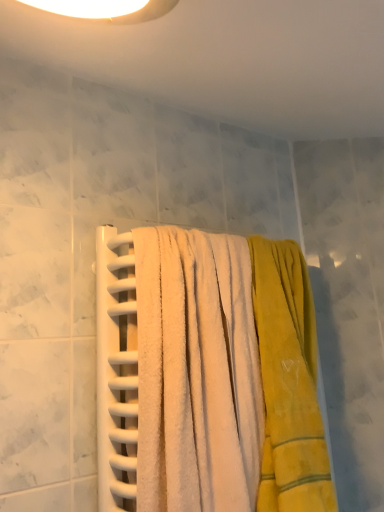
Question: Which direction should I rotate to look at white soft towel at center, the first towel viewed from the left?

Choices:
 (A) right
 (B) left

Answer: (A)

Question: Is yellow soft towel at center, the 1th towel in the right-to-left sequence, beside white soft towel at center, the first towel viewed from the left?

Choices:
 (A) no
 (B) yes

Answer: (A)

Question: Is white soft towel at center, the first towel viewed from the left, at the back of yellow soft towel at center, the 1th towel in the right-to-left sequence?

Choices:
 (A) yes
 (B) no

Answer: (B)

Question: Is white soft towel at center, the 2th towel when ordered from right to left, located within yellow soft towel at center, the 1th towel in the right-to-left sequence?

Choices:
 (A) no
 (B) yes

Answer: (A)

Question: Does yellow soft towel at center, which is the second towel in left-to-right order, have a larger size compared to white soft towel at center, the first towel viewed from the left?

Choices:
 (A) no
 (B) yes

Answer: (A)

Question: Does yellow soft towel at center, which is the second towel in left-to-right order, come behind white soft towel at center, the 2th towel when ordered from right to left?

Choices:
 (A) no
 (B) yes

Answer: (B)

Question: Does yellow soft towel at center, which is the second towel in left-to-right order, have a lesser width compared to white soft towel at center, the first towel viewed from the left?

Choices:
 (A) no
 (B) yes

Answer: (B)

Question: Is white soft towel at center, the 2th towel when ordered from right to left, bigger than yellow soft towel at center, which is the second towel in left-to-right order?

Choices:
 (A) yes
 (B) no

Answer: (A)

Question: Is white soft towel at center, the first towel viewed from the left, closer to camera compared to yellow soft towel at center, which is the second towel in left-to-right order?

Choices:
 (A) no
 (B) yes

Answer: (B)

Question: From a real-world perspective, does white soft towel at center, the first towel viewed from the left, sit lower than yellow soft towel at center, the 1th towel in the right-to-left sequence?

Choices:
 (A) no
 (B) yes

Answer: (A)

Question: Does white soft towel at center, the first towel viewed from the left, have a lesser width compared to yellow soft towel at center, the 1th towel in the right-to-left sequence?

Choices:
 (A) yes
 (B) no

Answer: (B)

Question: Is yellow soft towel at center, the 1th towel in the right-to-left sequence, surrounded by white soft towel at center, the first towel viewed from the left?

Choices:
 (A) yes
 (B) no

Answer: (B)

Question: Are white soft towel at center, the first towel viewed from the left, and yellow soft towel at center, the 1th towel in the right-to-left sequence, far apart?

Choices:
 (A) no
 (B) yes

Answer: (A)

Question: From the image's perspective, is yellow soft towel at center, the 1th towel in the right-to-left sequence, above or below white soft towel at center, the 2th towel when ordered from right to left?

Choices:
 (A) below
 (B) above

Answer: (A)